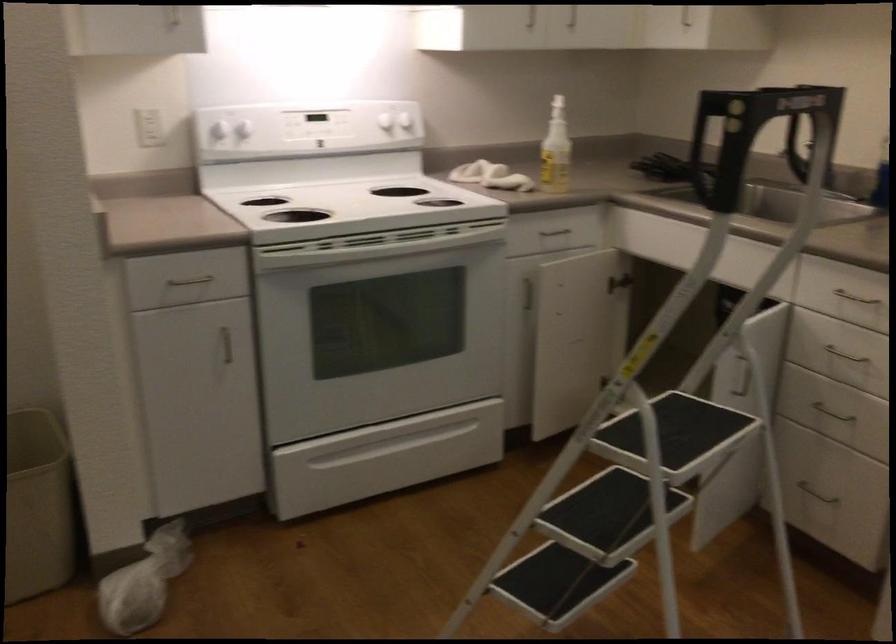
The width and height of the screenshot is (896, 644). In order to click on spray bottle trigger in this screenshot , I will do `click(557, 97)`.